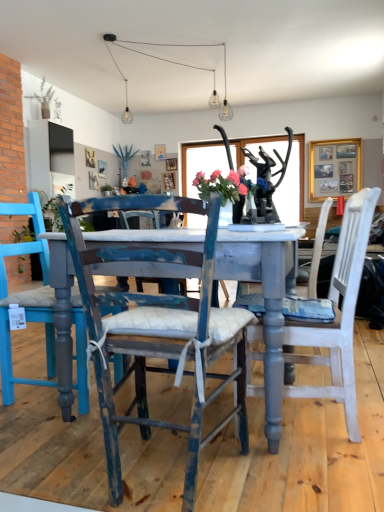
Question: Would you say white painted wood chair at center, which appears as the 1th chair when viewed from the right, is to the left or to the right of white matte vase at upper left, which ranks as the second plant in right-to-left order, in the picture?

Choices:
 (A) right
 (B) left

Answer: (A)

Question: Which is correct: white painted wood chair at center, which appears as the 1th chair when viewed from the right, is inside white matte vase at upper left, acting as the 1th plant starting from the front, or outside of it?

Choices:
 (A) outside
 (B) inside

Answer: (A)

Question: Estimate the real-world distances between objects in this image. Which object is closer to the white matte vase at upper left, the second plant from the back?

Choices:
 (A) green leafy plant at upper center, positioned as the second plant in front-to-back order
 (B) distressed blue wood chair at center, the first chair in the left-to-right sequence
 (C) pink fabric flowers at center
 (D) white painted wood chair at center, which is counted as the second chair, starting from the left

Answer: (A)

Question: Considering the real-world distances, which object is farthest from the green leafy plant at upper center, acting as the 1th plant starting from the back?

Choices:
 (A) white painted wood chair at center, which appears as the 1th chair when viewed from the right
 (B) distressed blue wood chair at center, the second chair when ordered from right to left
 (C) white matte vase at upper left, which appears as the 1th plant when viewed from the left
 (D) pink fabric flowers at center

Answer: (B)